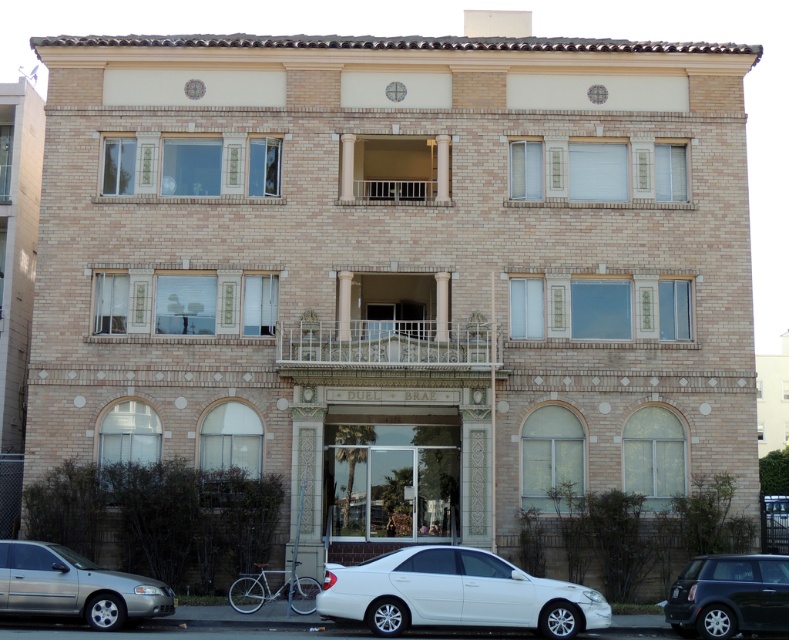
You are a delivery person trying to park your shiny black car at lower right near the building. There is a white wrought iron balcony at center above where you want to park. Will the balcony overhang block your car from being parked directly underneath it?

The white wrought iron balcony at center is above the shiny black car at lower right, so the balcony overhang may block the car from being parked directly underneath it. Choose another parking spot.

You are a delivery person trying to park your shiny black car at lower right near the metallic silver balcony at center. Based on the scene, can you park the car to the left of the balcony?

Yes, the shiny black car at lower right can be parked to the left of the metallic silver balcony at center because it is currently positioned to the right of it, so moving it left would place it in the desired position.

You are standing at the entrance of the building and want to take a photo of the point at coordinates point (x=507, y=588). The camera you are using has a maximum zoom range of 25 meters. Can you capture the point in focus without moving closer?

The point point (x=507, y=588) is 26.37 meters away from the camera, which exceeds the maximum zoom range of 25 meters. Therefore, you cannot capture the point in focus without moving closer.